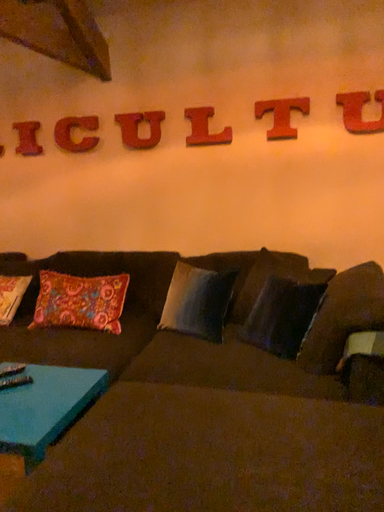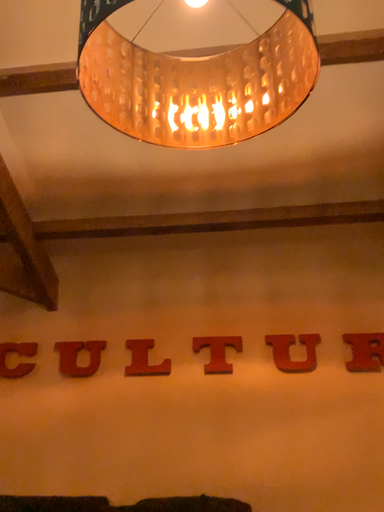
Question: Which way did the camera rotate in the video?

Choices:
 (A) rotated left
 (B) rotated right

Answer: (B)